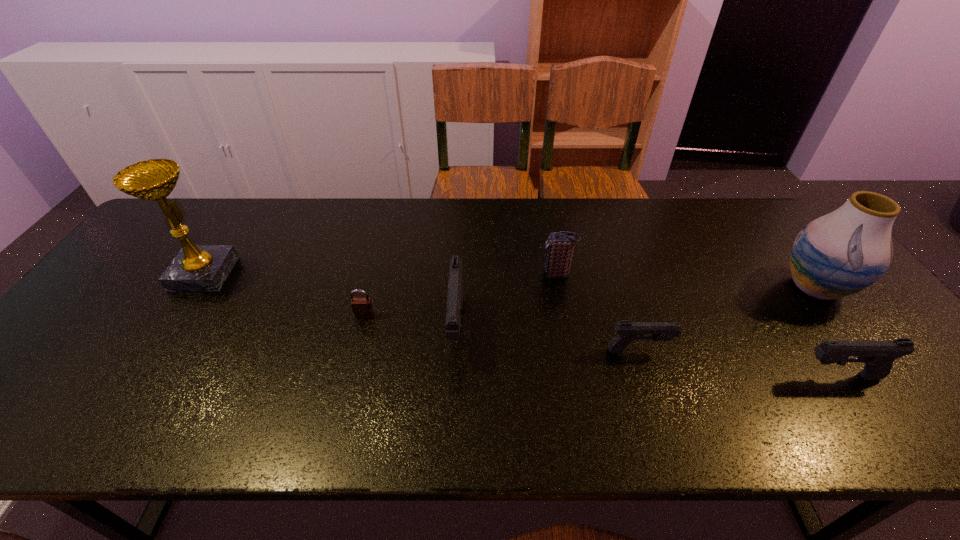
In order to click on object at the near edge in this screenshot , I will do `click(878, 355)`.

The image size is (960, 540). I want to click on pistol that is at the right edge, so click(878, 355).

Locate an element on the screen. vase situated at the right edge is located at coordinates (839, 254).

Where is `object situated at the near right corner`? object situated at the near right corner is located at coordinates (878, 355).

This screenshot has height=540, width=960. I want to click on vacant region at the far edge, so point(460,204).

Locate an element on the screen. The height and width of the screenshot is (540, 960). free space at the near edge of the desktop is located at coordinates (152, 386).

Locate an element on the screen. The image size is (960, 540). vacant space at the far left corner of the desktop is located at coordinates (217, 208).

Where is `free space at the far right corner`? This screenshot has width=960, height=540. free space at the far right corner is located at coordinates (756, 212).

Identify the location of vacant region between the vase and the tallest pistol. (636, 307).

In order to click on empty space between the fourth object from left to right and the vase in this screenshot , I will do point(686,281).